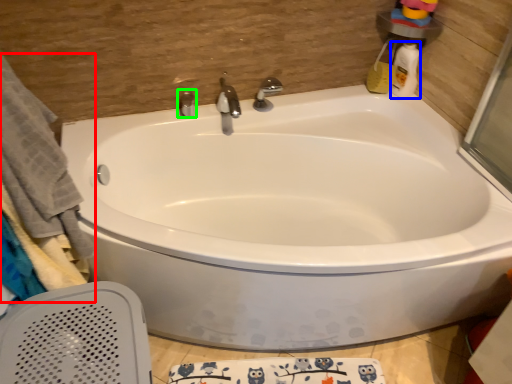
Question: Estimate the real-world distances between objects in this image. Which object is closer to bath towel (highlighted by a red box), cleaning product (highlighted by a blue box) or tap (highlighted by a green box)?

Choices:
 (A) cleaning product
 (B) tap

Answer: (B)